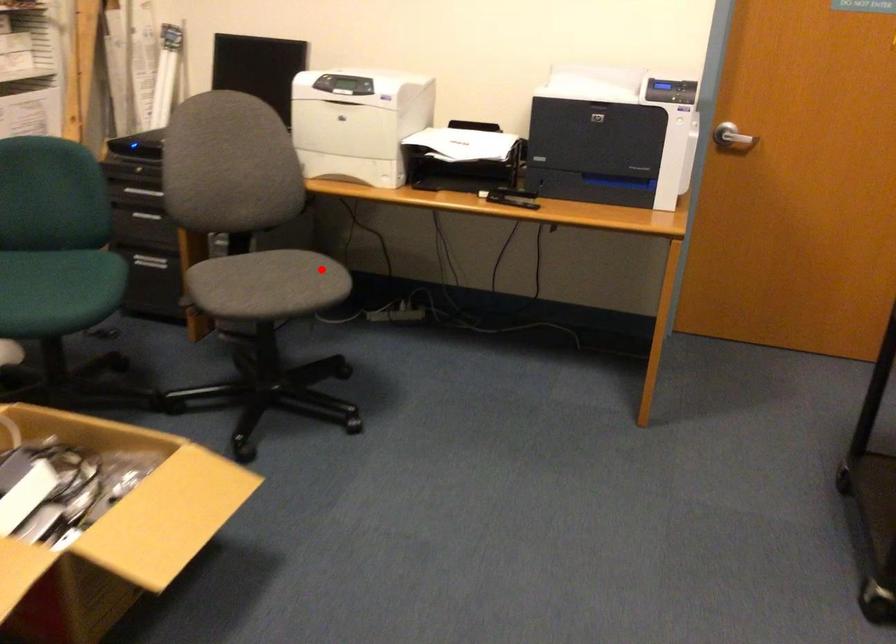
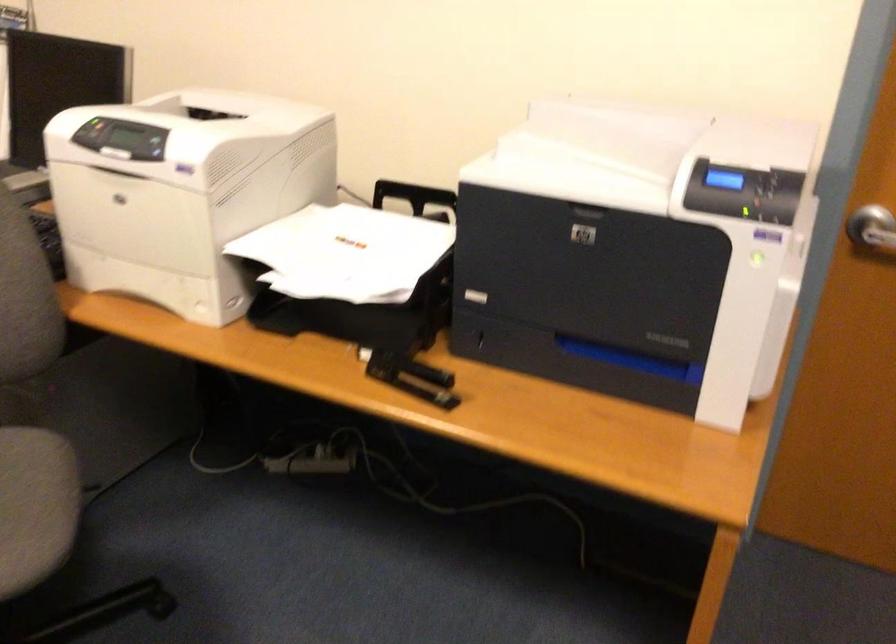
Question: I am providing you with two images of the same scene from different viewpoints. Image1 has a red point marked. In image2, the corresponding 3D location appears at what relative position? Reply with the corresponding letter.

Choices:
 (A) Closer
 (B) Farther

Answer: (A)